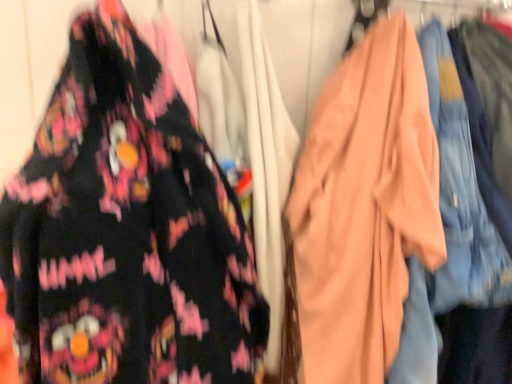
Find the location of a particular element. This screenshot has height=384, width=512. matte peach robe at center is located at coordinates (361, 212).

The width and height of the screenshot is (512, 384). What do you see at coordinates (361, 212) in the screenshot?
I see `matte peach robe at center` at bounding box center [361, 212].

Image resolution: width=512 pixels, height=384 pixels. I want to click on matte black shirt at left, so click(126, 231).

Measure the distance between point (x=122, y=143) and camera.

A distance of 18.23 inches exists between point (x=122, y=143) and camera.

What do you see at coordinates (126, 231) in the screenshot?
I see `matte black shirt at left` at bounding box center [126, 231].

Identify the location of matte peach robe at center. pyautogui.click(x=361, y=212).

Which object is positioned more to the right, matte peach robe at center or matte black shirt at left?

Positioned to the right is matte peach robe at center.

Does matte peach robe at center come behind matte black shirt at left?

Yes, it is.

Is point (404, 235) positioned in front of point (15, 176)?

No, (404, 235) is behind (15, 176).

From the image's perspective, relative to matte black shirt at left, is matte peach robe at center above or below?

From the image's perspective, matte peach robe at center appears below matte black shirt at left.

From a real-world perspective, is matte peach robe at center located beneath matte black shirt at left?

Yes.

Which of these two, matte peach robe at center or matte black shirt at left, is wider?

matte peach robe at center.

Does matte peach robe at center have a lesser height compared to matte black shirt at left?

Incorrect, the height of matte peach robe at center does not fall short of that of matte black shirt at left.

Considering the relative sizes of matte peach robe at center and matte black shirt at left in the image provided, is matte peach robe at center smaller than matte black shirt at left?

Actually, matte peach robe at center might be larger than matte black shirt at left.

Is matte peach robe at center positioned beyond the bounds of matte black shirt at left?

Yes, matte peach robe at center is not within matte black shirt at left.

Is matte peach robe at center not near matte black shirt at left?

No, matte peach robe at center is in close proximity to matte black shirt at left.

Could you tell me if matte peach robe at center is turned towards matte black shirt at left?

No, matte peach robe at center is not turned towards matte black shirt at left.

From the picture: How different are the orientations of matte peach robe at center and matte black shirt at left in degrees?

The facing directions of matte peach robe at center and matte black shirt at left are 0.000957 degrees apart.

Identify the location of fancy dress that is in front of the matte peach robe at center. The height and width of the screenshot is (384, 512). (126, 231).

Considering the positions of objects matte black shirt at left and matte peach robe at center in the image provided, who is more to the left, matte black shirt at left or matte peach robe at center?

Positioned to the left is matte black shirt at left.

Between matte black shirt at left and matte peach robe at center, which one is positioned in front?

Positioned in front is matte black shirt at left.

Is point (173, 322) farther from camera compared to point (354, 119)?

No, it is not.

From the image's perspective, between matte black shirt at left and matte peach robe at center, which one is located above?

matte black shirt at left is shown above in the image.

From a real-world perspective, between matte black shirt at left and matte peach robe at center, who is vertically lower?

matte peach robe at center is physically lower.

Is matte black shirt at left wider or thinner than matte peach robe at center?

matte black shirt at left is thinner than matte peach robe at center.

Considering the sizes of objects matte black shirt at left and matte peach robe at center in the image provided, who is taller, matte black shirt at left or matte peach robe at center?

Standing taller between the two is matte peach robe at center.

Is matte black shirt at left smaller than matte peach robe at center?

Yes, matte black shirt at left is smaller than matte peach robe at center.

Consider the image. Is matte black shirt at left located outside matte peach robe at center?

That's correct, matte black shirt at left is outside of matte peach robe at center.

Is matte black shirt at left not near matte peach robe at center?

No.

Is matte black shirt at left turned away from matte peach robe at center?

That's not correct — matte black shirt at left is not looking away from matte peach robe at center.

You are a GUI agent. You are given a task and a screenshot of the screen. Output one action in this format:
    pyautogui.click(x=<x>, y=<y>)
    Task: Click on the fancy dress that appears in front of the matte peach robe at center
    The image size is (512, 384).
    Given the screenshot: What is the action you would take?
    pyautogui.click(x=126, y=231)

You are a GUI agent. You are given a task and a screenshot of the screen. Output one action in this format:
    pyautogui.click(x=<x>, y=<y>)
    Task: Click on the fancy dress located above the matte peach robe at center (from a real-world perspective)
    The image size is (512, 384).
    Given the screenshot: What is the action you would take?
    pyautogui.click(x=126, y=231)

You are a GUI agent. You are given a task and a screenshot of the screen. Output one action in this format:
    pyautogui.click(x=<x>, y=<y>)
    Task: Click on the garment on the right of matte black shirt at left
    Image resolution: width=512 pixels, height=384 pixels.
    Given the screenshot: What is the action you would take?
    pyautogui.click(x=361, y=212)